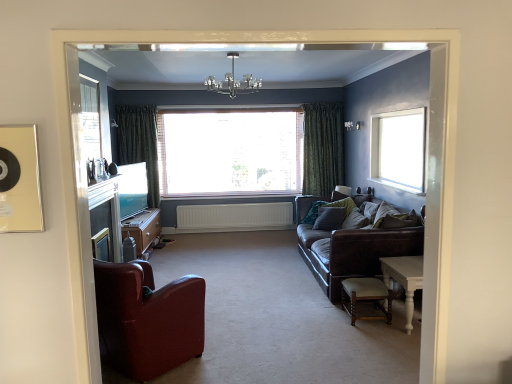
Question: Is green textured curtain at left, positioned as the first curtain in left-to-right order, at the right side of white matte radiator at center?

Choices:
 (A) no
 (B) yes

Answer: (A)

Question: From a real-world perspective, is green textured curtain at left, which is counted as the second curtain, starting from the right, on top of white matte radiator at center?

Choices:
 (A) yes
 (B) no

Answer: (A)

Question: Is green textured curtain at left, which is counted as the second curtain, starting from the right, further to the viewer compared to white matte radiator at center?

Choices:
 (A) no
 (B) yes

Answer: (A)

Question: Does green textured curtain at left, which is counted as the second curtain, starting from the right, have a lesser height compared to white matte radiator at center?

Choices:
 (A) no
 (B) yes

Answer: (A)

Question: Is green textured curtain at left, positioned as the first curtain in left-to-right order, closer to the viewer compared to white matte radiator at center?

Choices:
 (A) yes
 (B) no

Answer: (A)

Question: Does green textured curtain at left, positioned as the first curtain in left-to-right order, have a lesser width compared to white matte radiator at center?

Choices:
 (A) no
 (B) yes

Answer: (A)

Question: From the image's perspective, is clear glass window screen at upper left on top of teal fabric pillow at right, marked as the first pillow in a back-to-front arrangement?

Choices:
 (A) no
 (B) yes

Answer: (B)

Question: Is clear glass window screen at upper left looking in the opposite direction of teal fabric pillow at right, positioned as the 3th pillow in front-to-back order?

Choices:
 (A) yes
 (B) no

Answer: (B)

Question: From a real-world perspective, is clear glass window screen at upper left located higher than teal fabric pillow at right, positioned as the 3th pillow in front-to-back order?

Choices:
 (A) yes
 (B) no

Answer: (A)

Question: Is clear glass window screen at upper left beside teal fabric pillow at right, positioned as the 3th pillow in front-to-back order?

Choices:
 (A) yes
 (B) no

Answer: (B)

Question: From the image's perspective, is clear glass window screen at upper left below teal fabric pillow at right, positioned as the 3th pillow in front-to-back order?

Choices:
 (A) yes
 (B) no

Answer: (B)

Question: Is teal fabric pillow at right, marked as the first pillow in a back-to-front arrangement, located within clear glass window screen at upper left?

Choices:
 (A) no
 (B) yes

Answer: (A)

Question: Considering the relative sizes of white matte radiator at center and clear glass window screen at upper left in the image provided, is white matte radiator at center taller than clear glass window screen at upper left?

Choices:
 (A) yes
 (B) no

Answer: (B)